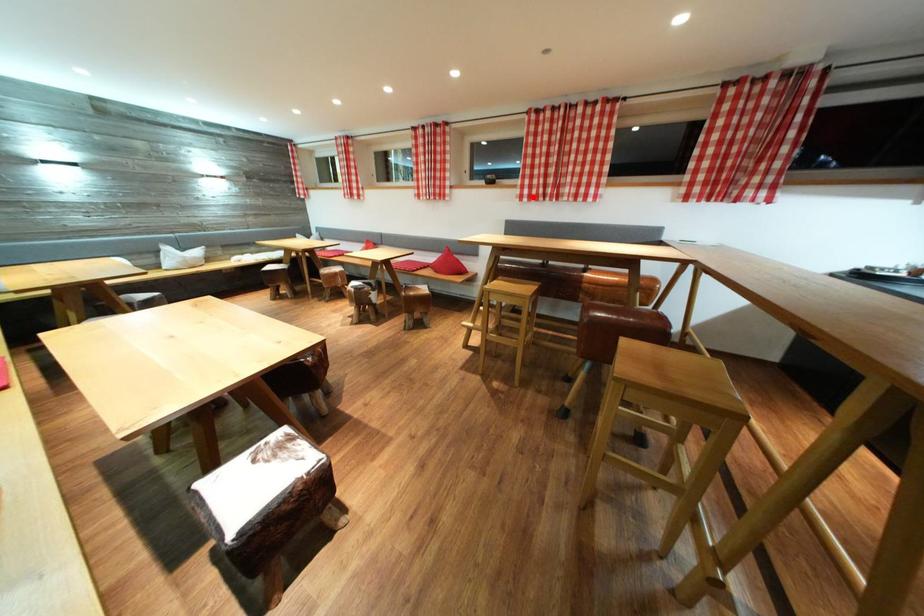
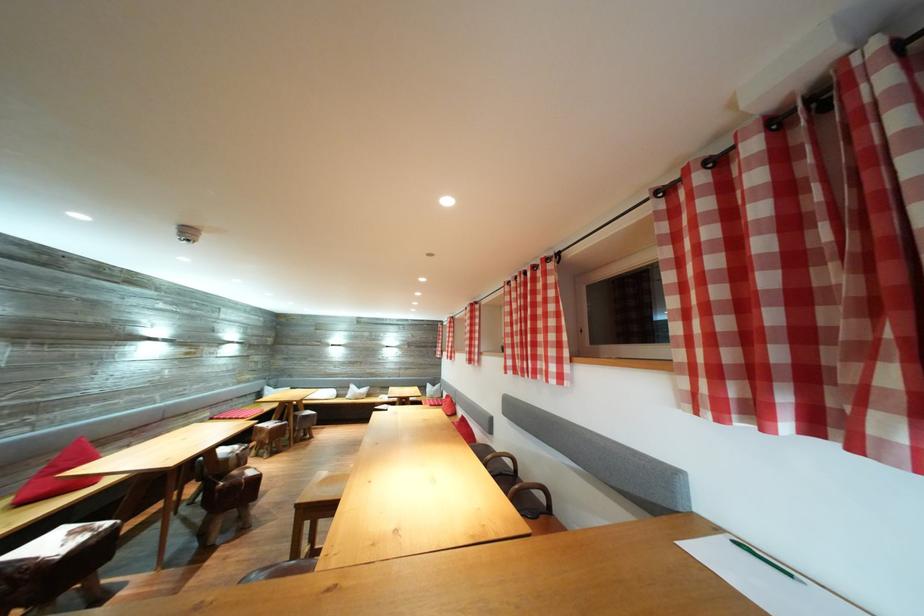
Question: I am providing you with two images of the same scene from different viewpoints. Image1 has a red point marked. In image2, the corresponding 3D location appears at what relative position? Reply with the corresponding letter.

Choices:
 (A) Closer
 (B) Farther

Answer: (B)